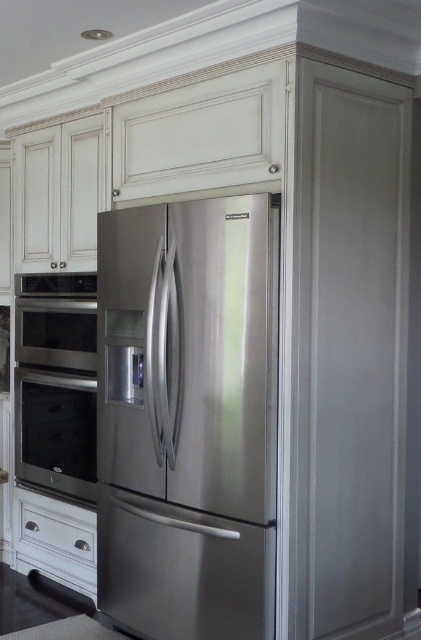
You are a kitchen designer planning to install a new microwave above the stainless steel oven at left and the white wood drawer at lower left. Based on their heights, which appliance should the microwave be placed above to ensure proper functionality?

The microwave should be placed above the stainless steel oven at left since it has a greater height, allowing for better accessibility and proper installation according to standard kitchen design principles.

You are a kitchen designer planning to install a new appliance. You have a stainless steel refrigerator at center and a stainless steel oven at left. Which appliance should you consider in terms of height if you want to place a shelf above them?

The stainless steel refrigerator at center is taller than the stainless steel oven at left, so you should consider the height of the stainless steel refrigerator at center to ensure the shelf is placed appropriately above it.